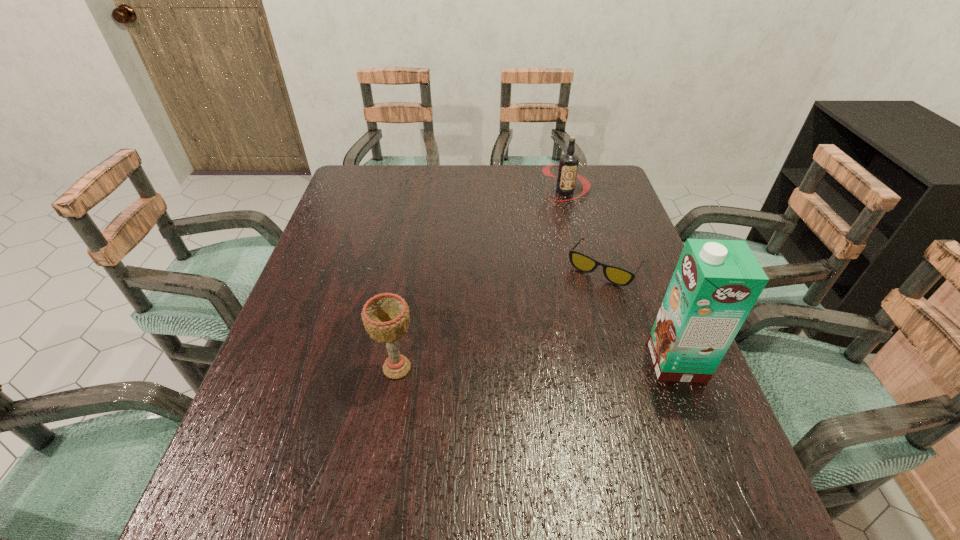
The width and height of the screenshot is (960, 540). In order to click on free space between the chalice and the tallest object in this screenshot , I will do `click(537, 365)`.

This screenshot has width=960, height=540. Identify the location of vacant area between the shortest object and the chalice. (500, 318).

Identify the location of vacant point located between the third nearest object and the tallest object. This screenshot has width=960, height=540. (640, 314).

Locate an element on the screen. The image size is (960, 540). free spot between the chalice and the sunglasses is located at coordinates (500, 318).

At what (x,y) coordinates should I click in order to perform the action: click on object that is the nearest to the chalice. Please return your answer as a coordinate pair (x, y). The width and height of the screenshot is (960, 540). Looking at the image, I should click on (619, 276).

Locate an element on the screen. The width and height of the screenshot is (960, 540). object identified as the third closest to the sunglasses is located at coordinates (386, 318).

What are the coordinates of `free region that satisfies the following two spatial constraints: 1. on the back side of the carton; 2. on the right side of the leftmost object` in the screenshot? It's located at (398, 361).

In order to click on vacant space that satisfies the following two spatial constraints: 1. on the back side of the farthest object; 2. on the left side of the chalice in this screenshot , I will do `click(426, 191)`.

Find the location of a particular element. The width and height of the screenshot is (960, 540). vacant point that satisfies the following two spatial constraints: 1. on the back side of the farthest object; 2. on the right side of the leftmost object is located at coordinates (426, 191).

In order to click on free space that satisfies the following two spatial constraints: 1. on the front side of the root beer; 2. on the left side of the sunglasses in this screenshot , I will do `click(585, 267)`.